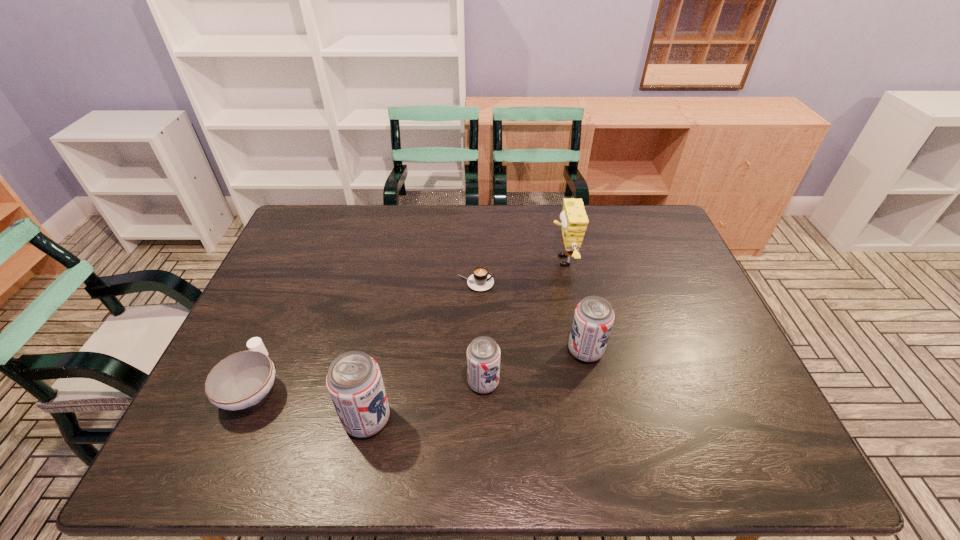
You are a GUI agent. You are given a task and a screenshot of the screen. Output one action in this format:
    pyautogui.click(x=<x>, y=<y>)
    Task: Click on the nearest beer can
    This screenshot has width=960, height=540.
    Given the screenshot: What is the action you would take?
    pyautogui.click(x=354, y=381)

Image resolution: width=960 pixels, height=540 pixels. Identify the location of the fifth object from right to left. (354, 381).

Locate an element on the screen. the second beer can from left to right is located at coordinates (483, 354).

The height and width of the screenshot is (540, 960). What are the coordinates of `the second farthest beer can` in the screenshot? It's located at (483, 354).

I want to click on the rightmost beer can, so click(x=593, y=319).

The width and height of the screenshot is (960, 540). In order to click on the second tallest beer can in this screenshot , I will do `click(593, 319)`.

Where is `sponge`? This screenshot has width=960, height=540. sponge is located at coordinates (574, 220).

Locate an element on the screen. This screenshot has width=960, height=540. cappuccino is located at coordinates (x=480, y=280).

Find the location of a particular element. Image resolution: width=960 pixels, height=540 pixels. the second shortest object is located at coordinates (241, 380).

Identify the location of chinaware. (241, 380).